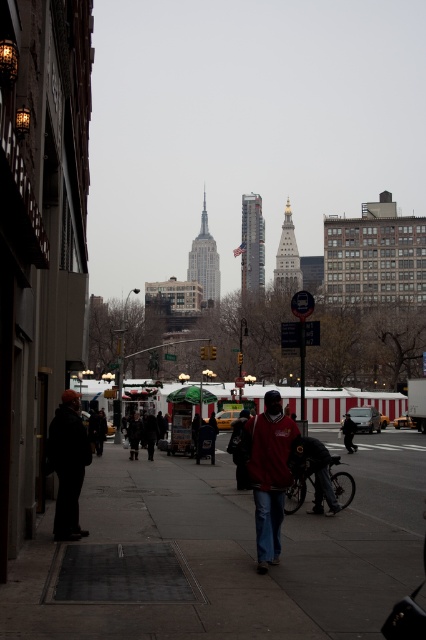
Is concrete sidewalk at center further to the viewer compared to matte red sweater at center?

That is False.

Can you confirm if concrete sidewalk at center is thinner than matte red sweater at center?

No, concrete sidewalk at center is not thinner than matte red sweater at center.

Which is in front, point (117, 628) or point (270, 502)?

Positioned in front is point (117, 628).

This screenshot has width=426, height=640. I want to click on concrete sidewalk at center, so click(x=236, y=552).

Does matte red sweater at center come in front of dark gray jacket at left?

Yes.

Which is in front, point (276, 465) or point (69, 492)?

Point (276, 465) is more forward.

Does point (264, 483) come farther from viewer compared to point (80, 424)?

No.

The image size is (426, 640). Find the location of `matte red sweater at center`. matte red sweater at center is located at coordinates point(268,474).

Is point (49, 464) behind point (351, 419)?

No, it is in front of (351, 419).

Can you confirm if dark gray jacket at left is bigger than dark blue jeans at center?

No.

Between point (66, 472) and point (351, 435), which one is positioned in front?

Point (66, 472)

Locate an element on the screen. This screenshot has height=640, width=426. dark gray jacket at left is located at coordinates (68, 465).